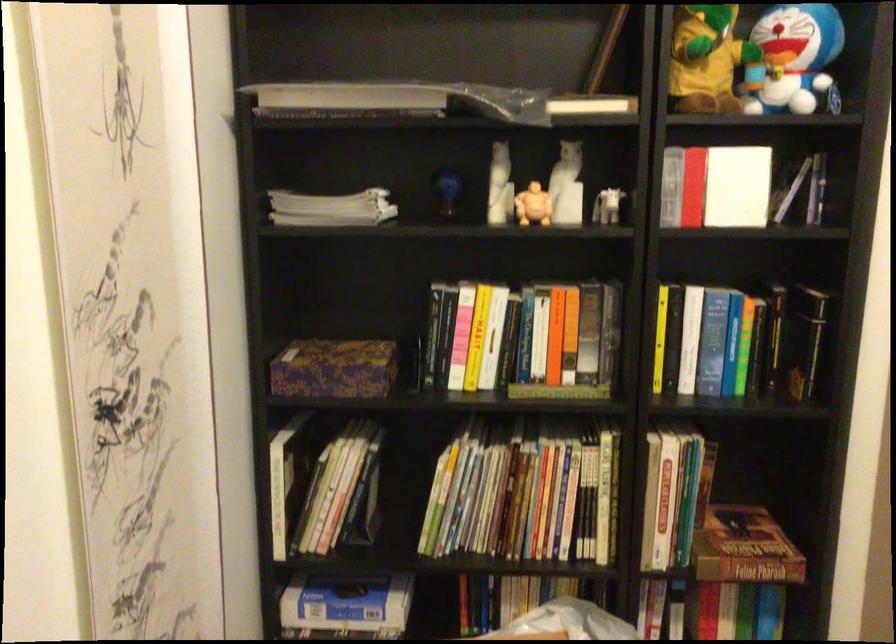
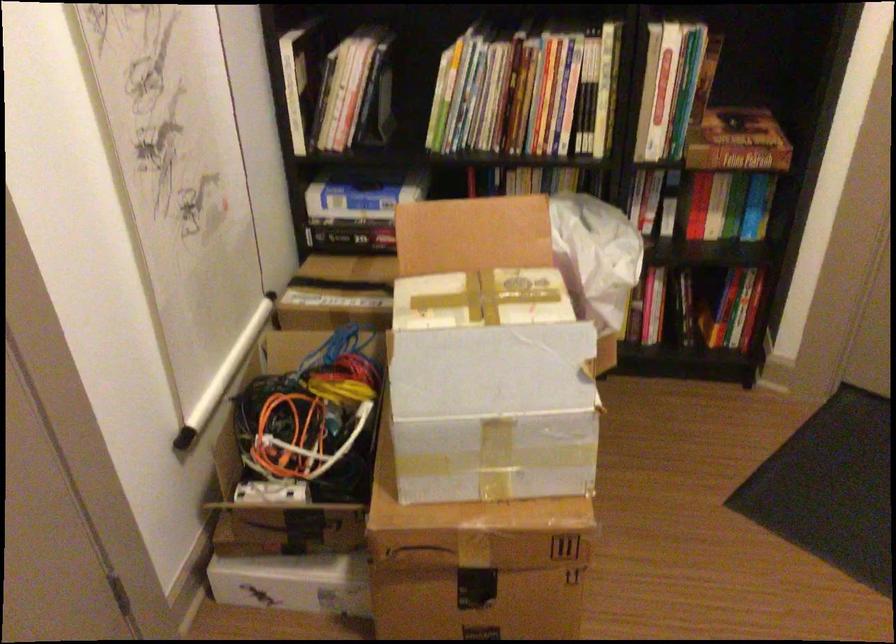
Find the pixel in the second image that matches point (322, 488) in the first image.

(334, 86)